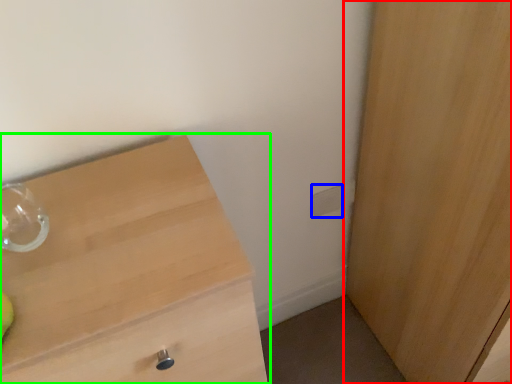
Question: Which object is the farthest from cupboard (highlighted by a red box)? Choose among these: electric outlet (highlighted by a blue box) or chest of drawers (highlighted by a green box).

Choices:
 (A) electric outlet
 (B) chest of drawers

Answer: (B)